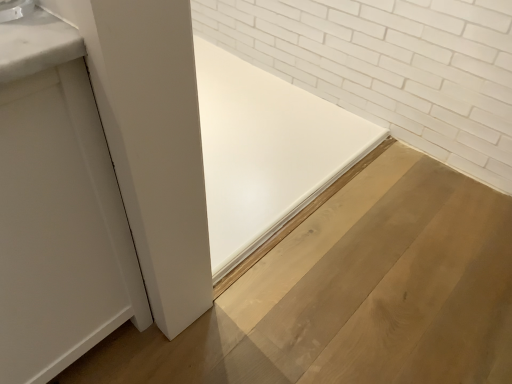
In order to face natural wood plywood at center, should I rotate leftwards or rightwards?

Turn left approximately 6.795 degrees to face it.

The width and height of the screenshot is (512, 384). Find the location of `white matte door at left`. white matte door at left is located at coordinates (60, 228).

You are a GUI agent. You are given a task and a screenshot of the screen. Output one action in this format:
    pyautogui.click(x=<x>, y=<y>)
    Task: Click on the natural wood plywood at center
    
    Given the screenshot: What is the action you would take?
    pyautogui.click(x=352, y=294)

Which is in front, point (482, 193) or point (110, 224)?

The point (110, 224) is in front.

Identify the location of plywood lying behind the white matte door at left. (352, 294).

From the image's perspective, is white matte door at left located above or below natural wood plywood at center?

white matte door at left is situated higher than natural wood plywood at center in the image.

Does white matte door at left appear on the right side of natural wood plywood at center?

In fact, white matte door at left is to the left of natural wood plywood at center.

Based on the photo, which of these two, white matte door at left or natural wood plywood at center, is smaller?

With smaller size is natural wood plywood at center.

Does satin nickel faucet at upper left have a larger size compared to natural wood plywood at center?

Actually, satin nickel faucet at upper left might be smaller than natural wood plywood at center.

From the image's perspective, between satin nickel faucet at upper left and natural wood plywood at center, which one is located above?

From the image's view, satin nickel faucet at upper left is above.

Is point (22, 16) positioned behind point (502, 271)?

No, (22, 16) is in front of (502, 271).

Find the location of `plywood on the right of satin nickel faucet at upper left`. plywood on the right of satin nickel faucet at upper left is located at coordinates (352, 294).

From a real-world perspective, is satin nickel faucet at upper left physically located above or below white matte door at left?

Clearly, from a real-world perspective, satin nickel faucet at upper left is above white matte door at left.

Is satin nickel faucet at upper left facing towards white matte door at left?

No, satin nickel faucet at upper left is not oriented towards white matte door at left.

Considering their positions, is satin nickel faucet at upper left located in front of or behind white matte door at left?

In the image, satin nickel faucet at upper left appears behind white matte door at left.

Consider the image. Which of these two, satin nickel faucet at upper left or white matte door at left, stands shorter?

With less height is satin nickel faucet at upper left.

Does natural wood plywood at center appear on the right side of satin nickel faucet at upper left?

Yes, natural wood plywood at center is to the right of satin nickel faucet at upper left.

From a real-world perspective, is natural wood plywood at center on top of satin nickel faucet at upper left?

Incorrect, from a real-world perspective, natural wood plywood at center is lower than satin nickel faucet at upper left.

Is white matte door at left placed right next to satin nickel faucet at upper left?

white matte door at left and satin nickel faucet at upper left are clearly separated.

Locate an element on the screen. This screenshot has width=512, height=384. faucet located on the right of white matte door at left is located at coordinates (15, 9).

In the image, is white matte door at left positioned in front of or behind satin nickel faucet at upper left?

Visually, white matte door at left is located in front of satin nickel faucet at upper left.

From the image's perspective, is white matte door at left below satin nickel faucet at upper left?

Yes.

The height and width of the screenshot is (384, 512). Identify the location of door located above the natural wood plywood at center (from the image's perspective). (60, 228).

At what (x,y) coordinates should I click in order to perform the action: click on plywood below the white matte door at left (from the image's perspective). Please return your answer as a coordinate pair (x, y). The height and width of the screenshot is (384, 512). Looking at the image, I should click on (352, 294).

Looking at the image, which one is located further to natural wood plywood at center, white matte door at left or satin nickel faucet at upper left?

Based on the image, satin nickel faucet at upper left appears to be further to natural wood plywood at center.

Considering their positions, is satin nickel faucet at upper left positioned closer to natural wood plywood at center than white matte door at left?

Among the two, white matte door at left is located nearer to natural wood plywood at center.

From the image, which object appears to be farther from white matte door at left, natural wood plywood at center or satin nickel faucet at upper left?

natural wood plywood at center.

Considering their positions, is satin nickel faucet at upper left positioned further to white matte door at left than natural wood plywood at center?

Among the two, natural wood plywood at center is located further to white matte door at left.

Based on the photo, considering their positions, is white matte door at left positioned further to satin nickel faucet at upper left than natural wood plywood at center?

The object further to satin nickel faucet at upper left is natural wood plywood at center.

Looking at the image, which one is located closer to satin nickel faucet at upper left, natural wood plywood at center or white matte door at left?

white matte door at left is closer to satin nickel faucet at upper left.

What are the coordinates of `faucet located between white matte door at left and natural wood plywood at center in the left-right direction` in the screenshot? It's located at (15, 9).